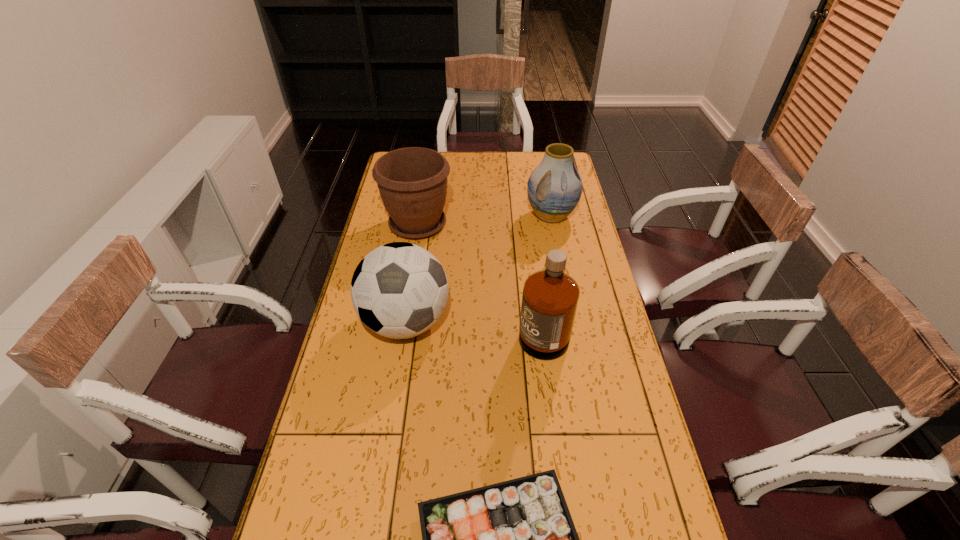
Locate an element on the screen. The width and height of the screenshot is (960, 540). liquor is located at coordinates (550, 297).

Locate an element on the screen. This screenshot has width=960, height=540. vase is located at coordinates (554, 188).

This screenshot has width=960, height=540. What are the coordinates of `soccer ball` in the screenshot? It's located at (399, 290).

Image resolution: width=960 pixels, height=540 pixels. Identify the location of flowerpot. (412, 181).

Locate an element on the screen. blank space located 0.330m on the front label of the liquor is located at coordinates (412, 326).

This screenshot has height=540, width=960. What are the coordinates of `vacant space situated 0.090m on the front label of the liquor` in the screenshot? It's located at (489, 326).

I want to click on vacant area located 0.100m on the front label of the liquor, so click(486, 326).

The width and height of the screenshot is (960, 540). Identify the location of free point located 0.280m on the front of the vase. (564, 282).

Image resolution: width=960 pixels, height=540 pixels. I want to click on vacant space located 0.360m on the main logo of the soccer ball, so click(380, 485).

Image resolution: width=960 pixels, height=540 pixels. I want to click on vacant space located on the front of the flowerpot, so coord(411,265).